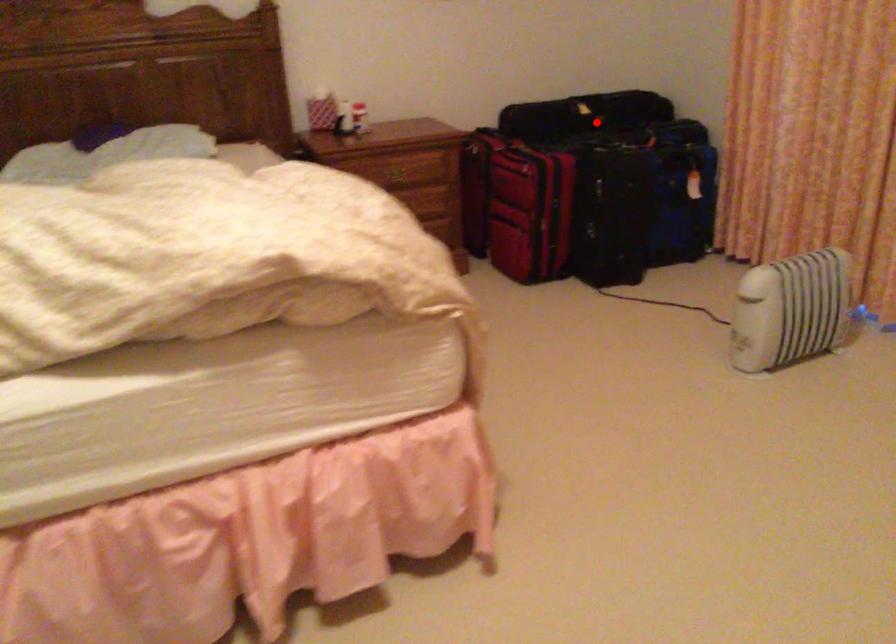
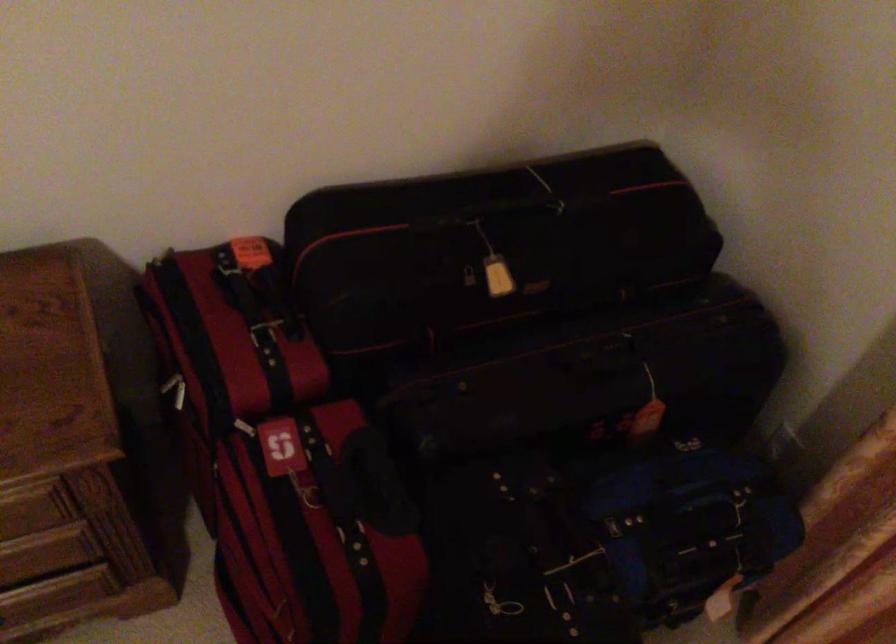
Question: I am providing you with two images of the same scene from different viewpoints. A red point is shown in image1. For the corresponding object point in image2, is it positioned nearer or farther from the camera?

Choices:
 (A) Nearer
 (B) Farther

Answer: (A)